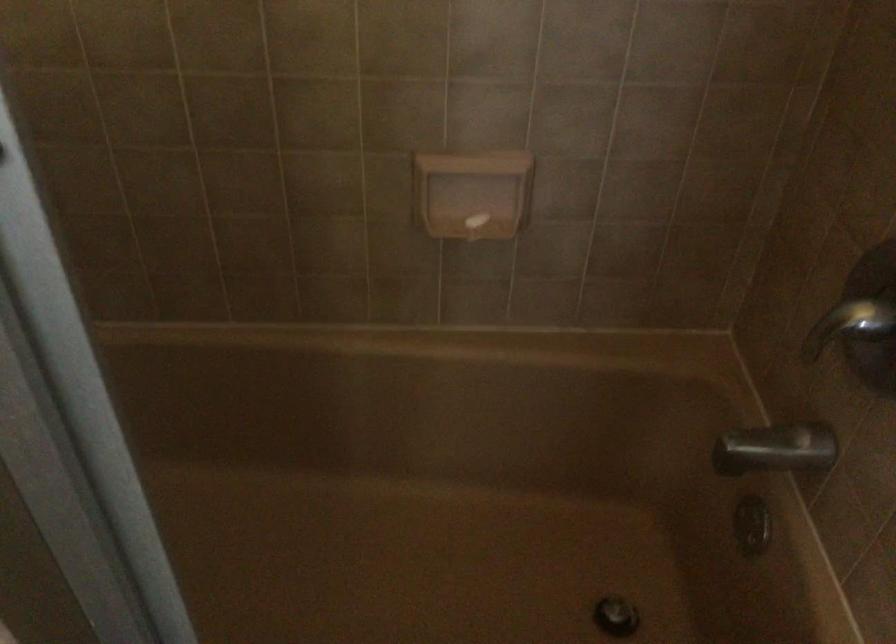
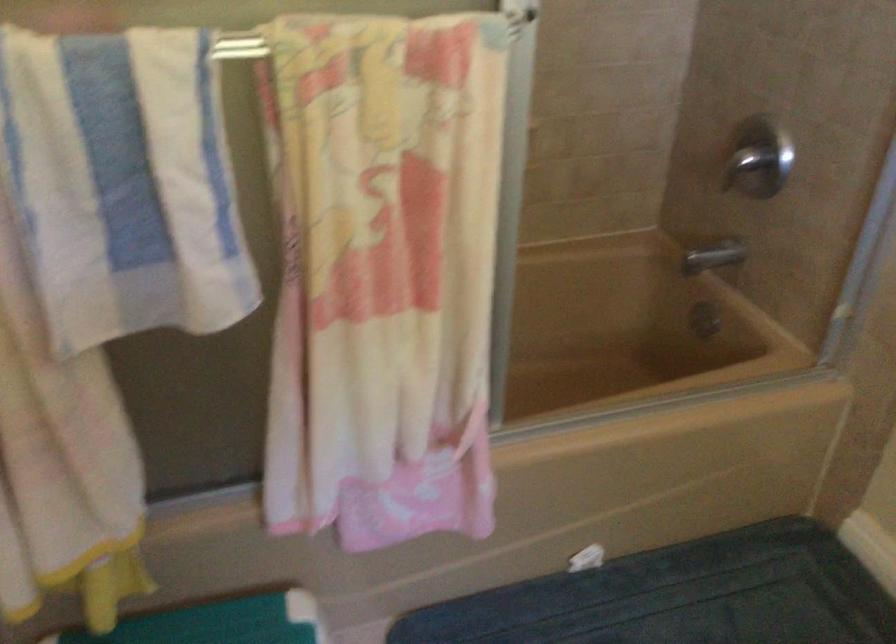
The images are taken continuously from a first-person perspective. In which direction are you moving?

The cameraman moved toward left, backward.